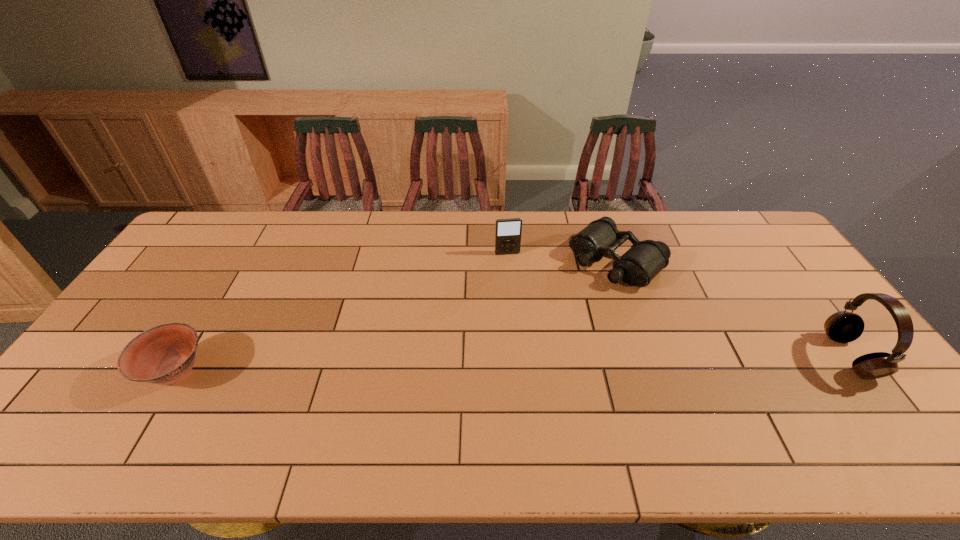
You are a GUI agent. You are given a task and a screenshot of the screen. Output one action in this format:
    pyautogui.click(x=<x>, y=<y>)
    Task: Click on the bowl
    Image resolution: width=960 pixels, height=540 pixels.
    Given the screenshot: What is the action you would take?
    pyautogui.click(x=165, y=354)

In order to click on headset in this screenshot , I will do `click(843, 327)`.

I want to click on the tallest object, so click(x=843, y=327).

I want to click on the third object from right to left, so click(x=508, y=232).

You are a GUI agent. You are given a task and a screenshot of the screen. Output one action in this format:
    pyautogui.click(x=<x>, y=<y>)
    Task: Click on the iPod
    This screenshot has width=960, height=540.
    Given the screenshot: What is the action you would take?
    pyautogui.click(x=508, y=232)

The width and height of the screenshot is (960, 540). Identify the location of binoculars. (645, 259).

Find the location of a particular element. This screenshot has height=540, width=960. vacant position located 0.140m on the left of the leftmost object is located at coordinates (87, 372).

At what (x,y) coordinates should I click in order to perform the action: click on vacant region located on the front-facing side of the third object from right to left. Please return your answer as a coordinate pair (x, y). This screenshot has height=540, width=960. Looking at the image, I should click on click(x=516, y=289).

What are the coordinates of `vacant space situated on the front-facing side of the third object from right to left` in the screenshot? It's located at (524, 323).

I want to click on free space located 0.330m on the front-facing side of the third object from right to left, so click(x=526, y=330).